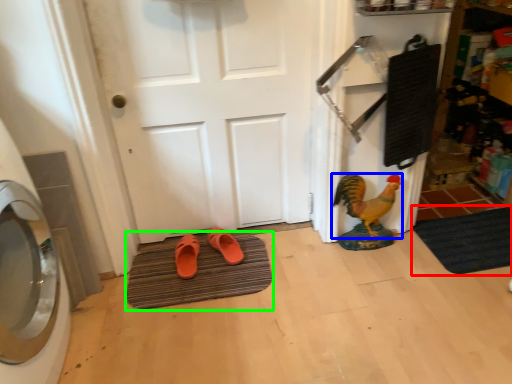
Question: Which object is positioned closest to bath mat (highlighted by a red box)? Select from chicken (highlighted by a blue box) and bath mat (highlighted by a green box).

Choices:
 (A) chicken
 (B) bath mat

Answer: (A)